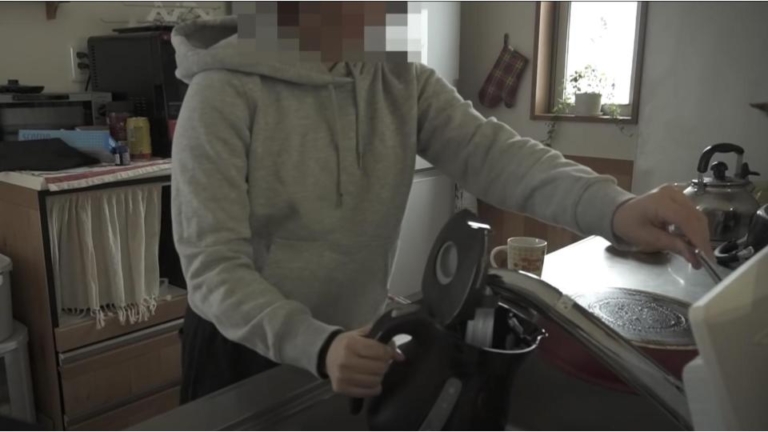
Locate an element on the screen. The height and width of the screenshot is (432, 768). outlet is located at coordinates (81, 60).